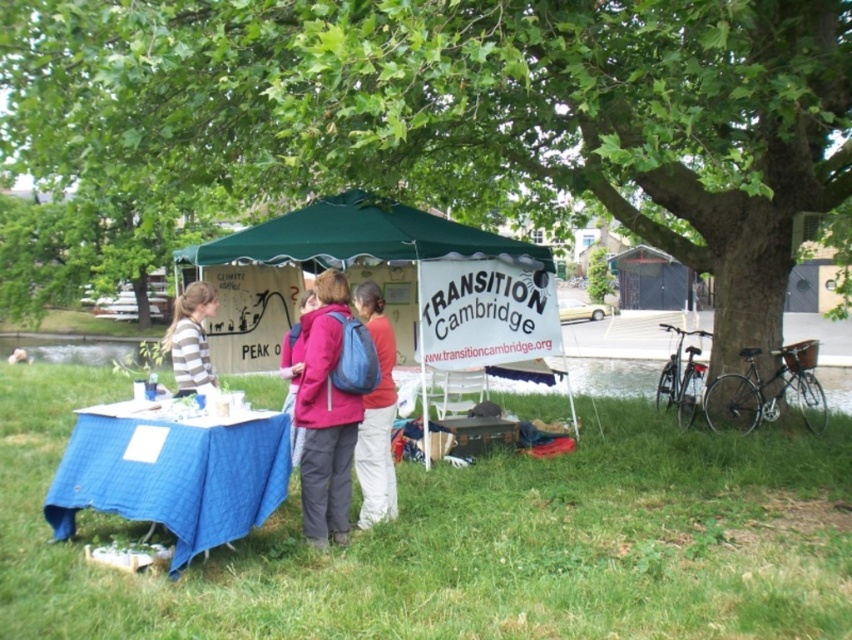
Who is taller, green grass at lower center or matte blue backpack at center?

matte blue backpack at center is taller.

From the picture: Can you confirm if green grass at lower center is taller than matte blue backpack at center?

In fact, green grass at lower center may be shorter than matte blue backpack at center.

Which is behind, point (511, 456) or point (393, 397)?

The point (511, 456) is behind.

Identify the location of green grass at lower center. tap(468, 540).

Does green fabric tent at center have a smaller size compared to blue fabric table at lower left?

Actually, green fabric tent at center might be larger than blue fabric table at lower left.

Can you confirm if green fabric tent at center is wider than blue fabric table at lower left?

Yes.

The width and height of the screenshot is (852, 640). Identify the location of green fabric tent at center. (416, 273).

The width and height of the screenshot is (852, 640). Find the location of `green fabric tent at center`. green fabric tent at center is located at coordinates (416, 273).

Is green grass at lower center shorter than green fabric tent at center?

Yes.

Does green grass at lower center have a larger size compared to green fabric tent at center?

Yes, green grass at lower center is bigger than green fabric tent at center.

This screenshot has width=852, height=640. I want to click on green grass at lower center, so click(x=468, y=540).